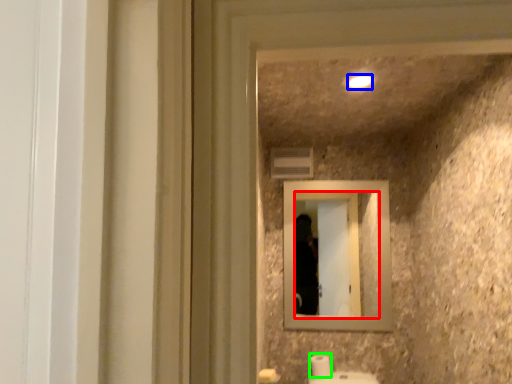
Question: Based on their relative distances, which object is farther from mirror (highlighted by a red box)? Choose from light (highlighted by a blue box) and toilet paper (highlighted by a green box).

Choices:
 (A) light
 (B) toilet paper

Answer: (A)